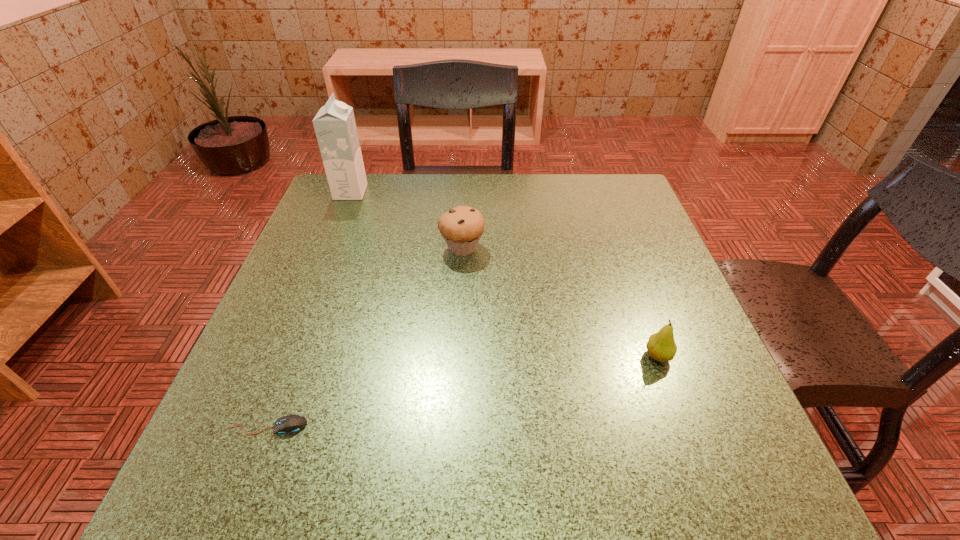
Where is `vacant space that satisfies the following two spatial constraints: 1. on the front label of the tallest object; 2. on the back side of the pear`? This screenshot has width=960, height=540. vacant space that satisfies the following two spatial constraints: 1. on the front label of the tallest object; 2. on the back side of the pear is located at coordinates (286, 356).

At what (x,y) coordinates should I click in order to perform the action: click on free space that satisfies the following two spatial constraints: 1. on the front label of the carton; 2. on the left side of the nearest object. Please return your answer as a coordinate pair (x, y). This screenshot has height=540, width=960. Looking at the image, I should click on (258, 426).

This screenshot has width=960, height=540. Find the location of `vacant space that satisfies the following two spatial constraints: 1. on the front label of the tallest object; 2. on the right side of the third farthest object`. vacant space that satisfies the following two spatial constraints: 1. on the front label of the tallest object; 2. on the right side of the third farthest object is located at coordinates (286, 356).

Find the location of a particular element. The image size is (960, 540). vacant space that satisfies the following two spatial constraints: 1. on the back side of the second farthest object; 2. on the front label of the farthest object is located at coordinates (465, 192).

Identify the location of vacant point that satisfies the following two spatial constraints: 1. on the front label of the third farthest object; 2. on the right side of the farthest object. The height and width of the screenshot is (540, 960). coord(286,356).

At what (x,y) coordinates should I click in order to perform the action: click on vacant space that satisfies the following two spatial constraints: 1. on the back side of the pear; 2. on the front label of the farthest object. Please return your answer as a coordinate pair (x, y). Looking at the image, I should click on (599, 192).